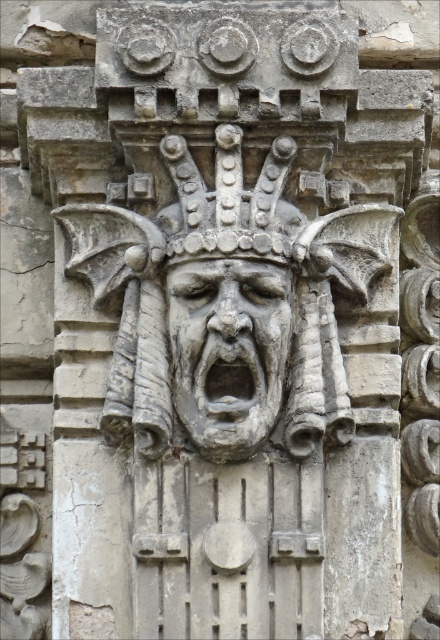
Who is taller, stone carving at center or gray stone face at center?

stone carving at center

In the scene shown: Which is more to the right, stone carving at center or gray stone face at center?

stone carving at center

Locate an element on the screen. stone carving at center is located at coordinates (227, 305).

What are the coordinates of `stone carving at center` in the screenshot? It's located at (227, 305).